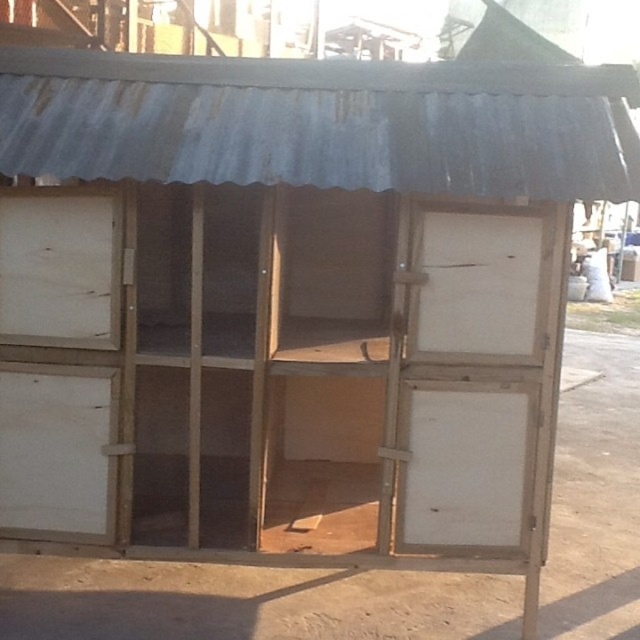
You are organizing a small storage area and need to place items in the white matte drawer at lower left and the white matte drawer at left. Since both drawers are white and matte, how can you distinguish which one is larger?

The white matte drawer at lower left is larger in size compared to the white matte drawer at left, so you can identify the larger one by its size difference.

You are standing in front of the structure and want to determine the relative positions of two points marked on the ground. Which point is closer to you, point 1 at coordinates point [68,396] or point 2 at coordinates point [52,323]?

Point 2 at coordinates point [52,323] is closer to you because it is less further to the camera than point 1 at coordinates point [68,396].

You are organizing a small workshop in the shelter and need to place a 16.5 inch wide tool box between the white matte drawer at lower left and the white matte drawer at left. Will the tool box fit in the space between them?

The white matte drawer at lower left and white matte drawer at left are 16.40 inches apart. Since the tool box is 16.5 inches wide, it will not fit between them as the space is slightly narrower.